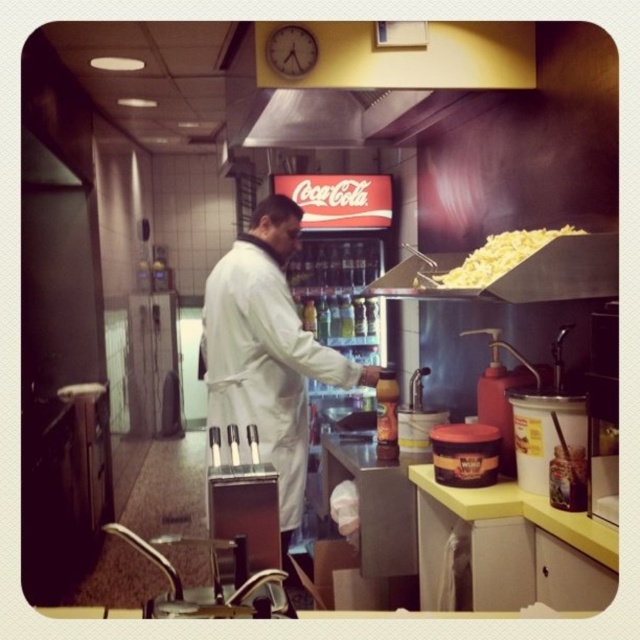
You are a customer looking at the counter in the fast food kitchen. You see the white matte coat at center and the yellow crumbly cheese at upper right. Which object is positioned higher up on the counter?

The yellow crumbly cheese at upper right is positioned higher up on the counter than the white matte coat at center.

You are a customer in the fast food restaurant and you see the white matte coat at center at point (268, 353). Can you tell me the exact coordinates of the white matte coat at center?

The white matte coat at center is located at point (268, 353).